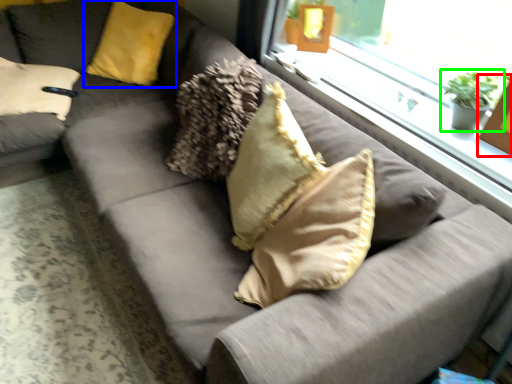
Question: Estimate the real-world distances between objects in this image. Which object is farther from picture frame (highlighted by a red box), pillow (highlighted by a blue box) or houseplant (highlighted by a green box)?

Choices:
 (A) pillow
 (B) houseplant

Answer: (A)